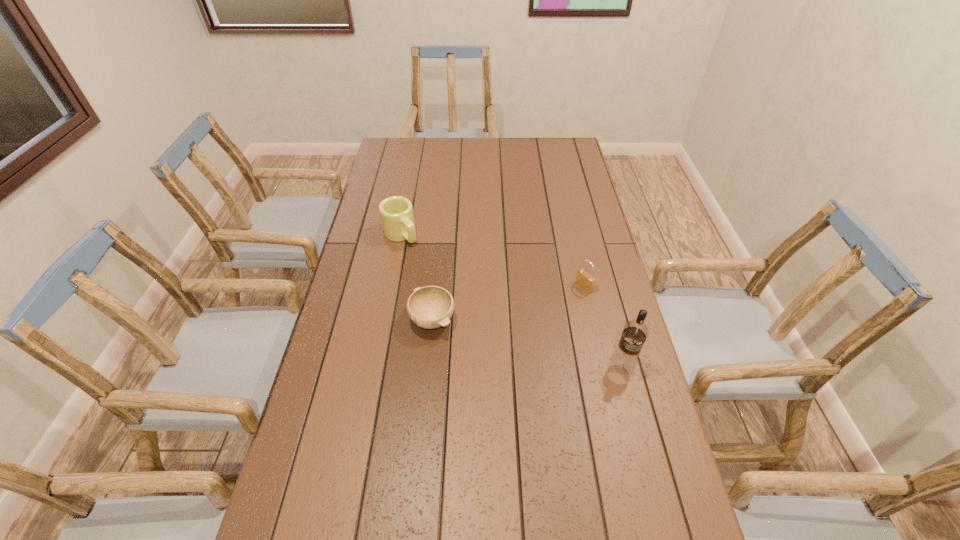
Identify the location of blank space at the near edge. The image size is (960, 540). (455, 524).

The width and height of the screenshot is (960, 540). I want to click on vacant space at the left edge of the desktop, so click(x=398, y=195).

Locate an element on the screen. The width and height of the screenshot is (960, 540). vacant space at the right edge of the desktop is located at coordinates (607, 433).

The height and width of the screenshot is (540, 960). What are the coordinates of `free region at the near right corner of the desktop` in the screenshot? It's located at click(x=658, y=507).

You are a GUI agent. You are given a task and a screenshot of the screen. Output one action in this format:
    pyautogui.click(x=<x>, y=<y>)
    Task: Click on the vacant space that's between the farthest object and the padlock
    
    Given the screenshot: What is the action you would take?
    pyautogui.click(x=492, y=260)

Image resolution: width=960 pixels, height=540 pixels. I want to click on free area in between the nearest object and the leftmost object, so click(x=512, y=299).

Identify the location of free space between the nearest object and the second object from right to left. (604, 325).

Where is `free space between the vodka and the second object from right to left`? free space between the vodka and the second object from right to left is located at coordinates click(x=604, y=325).

You are a GUI agent. You are given a task and a screenshot of the screen. Output one action in this format:
    pyautogui.click(x=<x>, y=<y>)
    Task: Click on the free space between the third farthest object and the vodka
    
    Given the screenshot: What is the action you would take?
    pyautogui.click(x=528, y=342)

Where is `vacant point located between the vodka and the leftmost object`? The image size is (960, 540). vacant point located between the vodka and the leftmost object is located at coordinates (512, 299).